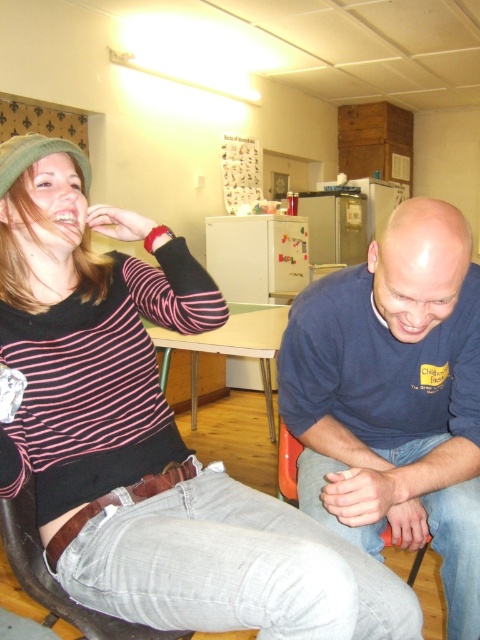
Consider the image. You are planning to rearrange the furniture in this room. If you want to place a new small plant between the brown leather chair at lower left and the light brown wooden table at center, will there be enough space for the plant?

The brown leather chair at lower left occupies less space than light brown wooden table at center. Since the chair takes up less space, there should be enough room between them to place a small plant.

You are sitting on the orange plastic chair at lower center and want to reach the light brown wooden table at center. Can you move forward without going under the table?

The orange plastic chair at lower center is behind the light brown wooden table at center, so you can move forward to reach the table without going under it.

You are an interior designer working on a layout for a living room. You need to place a new sofa that will occupy the space currently occupied by the blue cotton shirt at lower right. What coordinates should the sofa be placed at?

The sofa should be placed at coordinates point [395,397] where the blue cotton shirt at lower right is located.